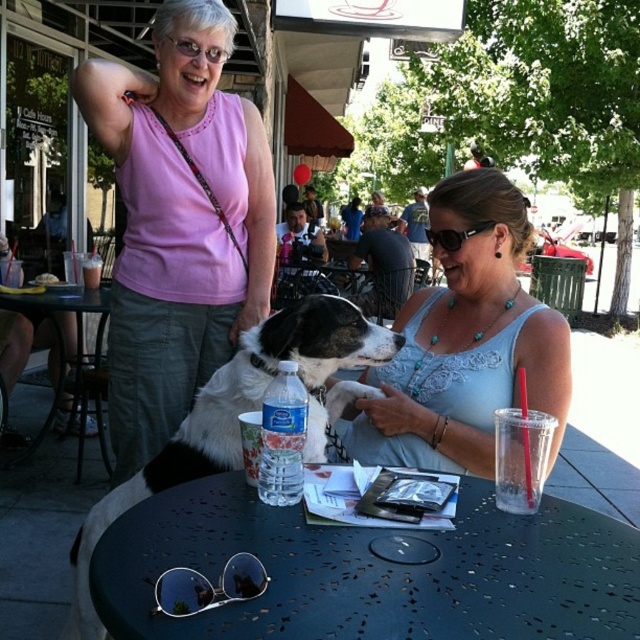
Who is positioned more to the left, metallic black table at center or metallic black table at lower left?

metallic black table at lower left

What do you see at coordinates (372, 570) in the screenshot? I see `metallic black table at center` at bounding box center [372, 570].

What are the coordinates of `metallic black table at center` in the screenshot? It's located at (372, 570).

Which is above, metallic black table at center or pink fabric tank top at upper left?

pink fabric tank top at upper left

Does point (573, 524) come in front of point (257, 252)?

Yes, it is in front of point (257, 252).

Identify the location of metallic black table at center. (372, 570).

Is point (413, 360) behind point (74, 560)?

Yes, it is behind point (74, 560).

Locate an element on the screen. Image resolution: width=640 pixels, height=640 pixels. pearl necklace at center is located at coordinates (465, 342).

At what (x,y) coordinates should I click in order to perform the action: click on pearl necklace at center. Please return your answer as a coordinate pair (x, y). Image resolution: width=640 pixels, height=640 pixels. Looking at the image, I should click on (465, 342).